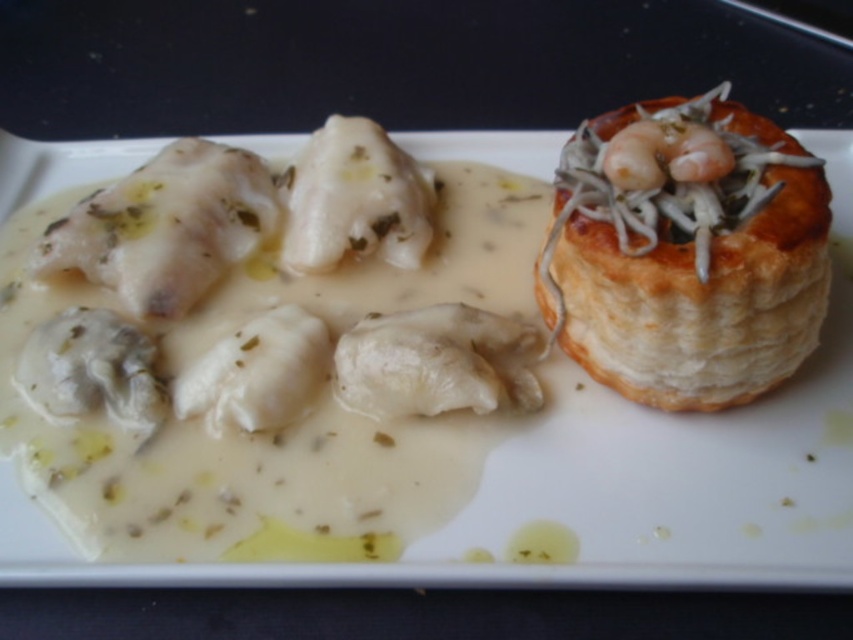
Question: Is white creamy sauce at upper left bigger than golden-brown flaky pastry at upper right?

Choices:
 (A) yes
 (B) no

Answer: (A)

Question: Which point appears farthest from the camera in this image?

Choices:
 (A) (485, 541)
 (B) (819, 264)

Answer: (A)

Question: Which point is farther to the camera?

Choices:
 (A) (463, 566)
 (B) (636, 134)

Answer: (B)

Question: Is white creamy sauce at upper left to the right of golden-brown flaky pastry at upper right from the viewer's perspective?

Choices:
 (A) no
 (B) yes

Answer: (A)

Question: Can you confirm if white creamy sauce at upper left is positioned to the left of golden-brown flaky pastry at upper right?

Choices:
 (A) yes
 (B) no

Answer: (A)